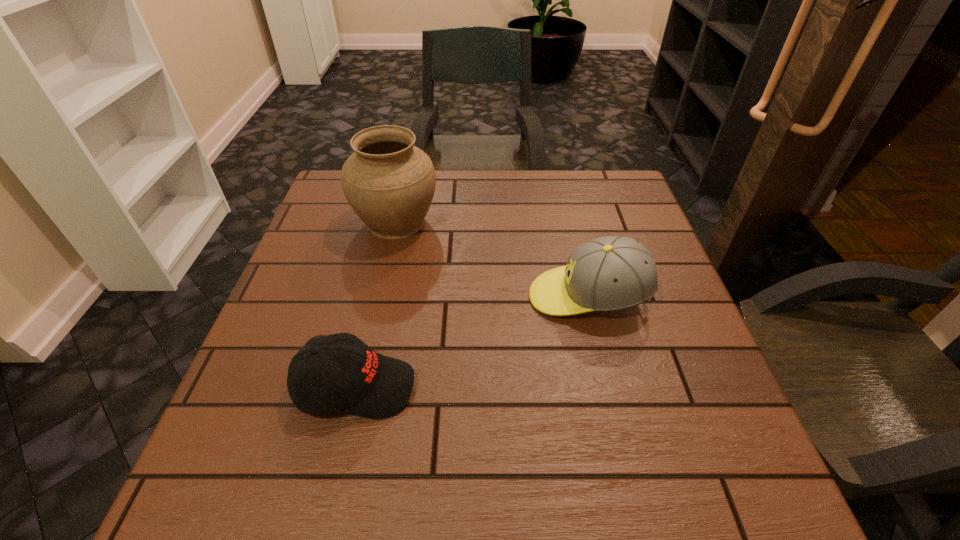
Locate an element on the screen. the farthest object is located at coordinates (390, 183).

Locate an element on the screen. The image size is (960, 540). the tallest object is located at coordinates (390, 183).

Identify the location of the rightmost object. The width and height of the screenshot is (960, 540). (610, 273).

Locate an element on the screen. This screenshot has width=960, height=540. the second shortest object is located at coordinates (610, 273).

Image resolution: width=960 pixels, height=540 pixels. Identify the location of the shorter baseball cap. (372, 385).

Locate an element on the screen. The width and height of the screenshot is (960, 540). the left baseball cap is located at coordinates (372, 385).

The width and height of the screenshot is (960, 540). I want to click on vacant area situated 0.080m on the left of the tallest object, so click(x=323, y=222).

Where is `free region located 0.260m on the front-facing side of the taller baseball cap`? This screenshot has height=540, width=960. free region located 0.260m on the front-facing side of the taller baseball cap is located at coordinates (x=407, y=297).

Locate an element on the screen. Image resolution: width=960 pixels, height=540 pixels. blank space located 0.290m on the front-facing side of the taller baseball cap is located at coordinates (394, 297).

I want to click on vacant space located 0.110m on the front-facing side of the taller baseball cap, so click(x=478, y=297).